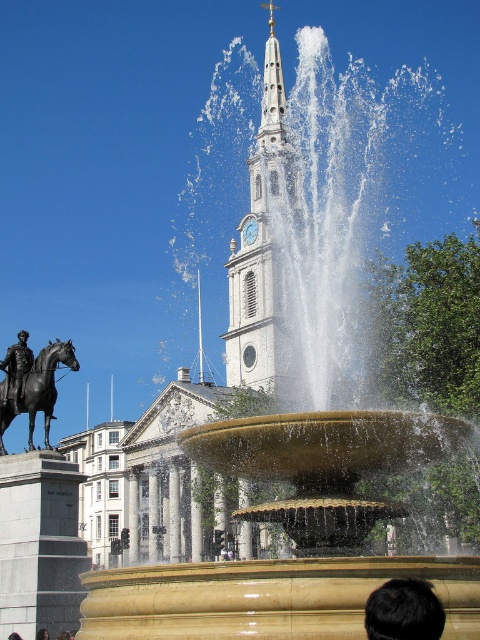
You are standing in front of the fountain and want to take a photo of the church tower. The camera you have can focus on objects up to 30 meters away. Is the point at coordinates point (389, 632) within the camera focus range?

The distance of point (389, 632) from viewer is 28.57 meters, which is within the camera focus range of 30 meters. Therefore, the camera can focus on the point at point (389, 632).

You are an architect visiting the city and want to take a photo of both the white stone clock tower at center and the polished bronze statue at left. Since you have a wide angle lens, you want to ensure both objects are in frame. Given the size difference between them, which object should you position closer to the camera to make them appear balanced in the photo?

The white stone clock tower at center is bigger than the polished bronze statue at left. To balance their sizes in the photo, position the polished bronze statue at left closer to the camera so that it appears larger, while moving the white stone clock tower at center further back or keeping it at a distance to reduce its apparent size.